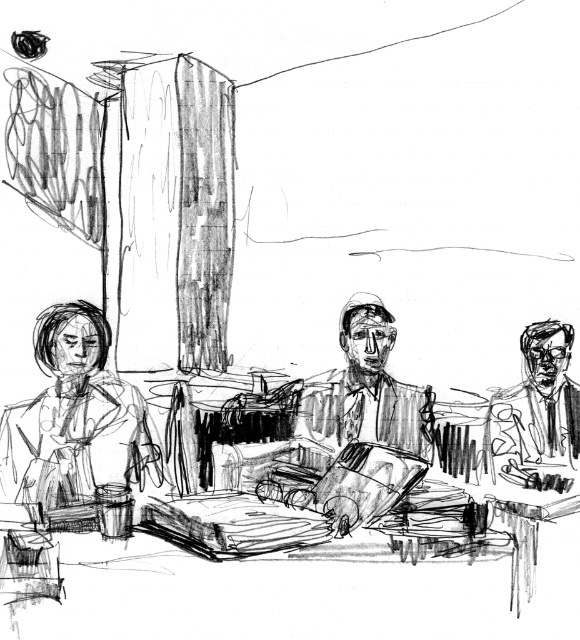
This screenshot has width=580, height=640. Describe the element at coordinates (78, 429) in the screenshot. I see `smooth skin woman at left` at that location.

I want to click on smooth skin woman at left, so click(x=78, y=429).

Locate an element on the screen. The width and height of the screenshot is (580, 640). smooth skin woman at left is located at coordinates tap(78, 429).

Is smooth skin woman at left positioned in front of smooth black suit at right?

Yes, smooth skin woman at left is in front of smooth black suit at right.

Measure the distance between smooth skin woman at left and camera.

They are 6.20 feet apart.

Measure the distance between smooth skin woman at left and camera.

A distance of 1.89 meters exists between smooth skin woman at left and camera.

Where is `smooth skin woman at left`? Image resolution: width=580 pixels, height=640 pixels. smooth skin woman at left is located at coordinates (x=78, y=429).

Is point (394, 388) closer to viewer compared to point (551, 321)?

Yes, point (394, 388) is closer to viewer.

Which is behind, point (383, 406) or point (523, 392)?

The point (523, 392) is more distant.

The width and height of the screenshot is (580, 640). I want to click on smooth brown leather jacket at center, so click(365, 390).